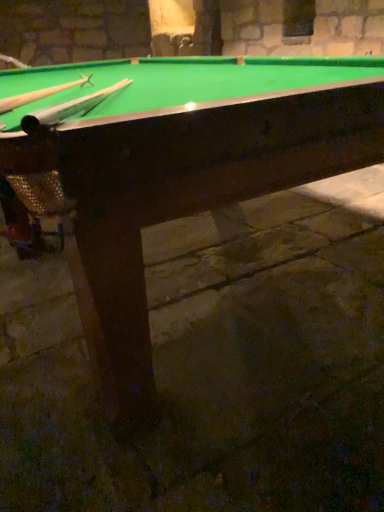
Question: From a real-world perspective, is wooden cue at upper left, which is the 2th cue in right-to-left order, located beneath green felt billiard table at center?

Choices:
 (A) no
 (B) yes

Answer: (A)

Question: Can you confirm if wooden cue at upper left, arranged as the 1th cue when viewed from the left, is thinner than green felt billiard table at center?

Choices:
 (A) yes
 (B) no

Answer: (A)

Question: Considering the relative sizes of wooden cue at upper left, which is the 2th cue in right-to-left order, and green felt billiard table at center in the image provided, is wooden cue at upper left, which is the 2th cue in right-to-left order, bigger than green felt billiard table at center?

Choices:
 (A) yes
 (B) no

Answer: (B)

Question: Is wooden cue at upper left, which is the 2th cue in right-to-left order, far away from green felt billiard table at center?

Choices:
 (A) no
 (B) yes

Answer: (A)

Question: Considering the relative positions of wooden cue at upper left, which is the 2th cue in right-to-left order, and green felt billiard table at center in the image provided, is wooden cue at upper left, which is the 2th cue in right-to-left order, to the left of green felt billiard table at center from the viewer's perspective?

Choices:
 (A) no
 (B) yes

Answer: (B)

Question: Could you tell me if wooden cue at upper left, arranged as the 1th cue when viewed from the left, is turned towards green felt billiard table at center?

Choices:
 (A) no
 (B) yes

Answer: (B)

Question: Is green felt billiard table at center positioned before wooden cue at upper left, which is the second cue in left-to-right order?

Choices:
 (A) yes
 (B) no

Answer: (A)

Question: Does green felt billiard table at center have a greater width compared to wooden cue at upper left, which is the second cue in left-to-right order?

Choices:
 (A) yes
 (B) no

Answer: (A)

Question: Is green felt billiard table at center bigger than wooden cue at upper left, positioned as the 1th cue in right-to-left order?

Choices:
 (A) yes
 (B) no

Answer: (A)

Question: Can wooden cue at upper left, which is the second cue in left-to-right order, be found inside green felt billiard table at center?

Choices:
 (A) yes
 (B) no

Answer: (A)

Question: Is green felt billiard table at center with wooden cue at upper left, which is the second cue in left-to-right order?

Choices:
 (A) no
 (B) yes

Answer: (A)

Question: Would you say green felt billiard table at center is outside wooden cue at upper left, positioned as the 1th cue in right-to-left order?

Choices:
 (A) no
 (B) yes

Answer: (B)

Question: Is wooden cue at upper left, arranged as the 1th cue when viewed from the left, surrounded by wooden cue at upper left, positioned as the 1th cue in right-to-left order?

Choices:
 (A) yes
 (B) no

Answer: (B)